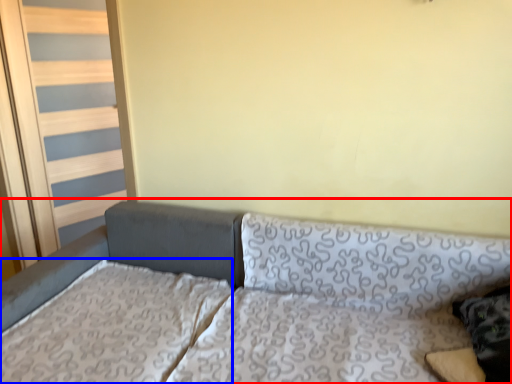
Question: Which point is closer to the camera, studio couch (highlighted by a red box) or mattress (highlighted by a blue box)?

Choices:
 (A) studio couch
 (B) mattress

Answer: (A)